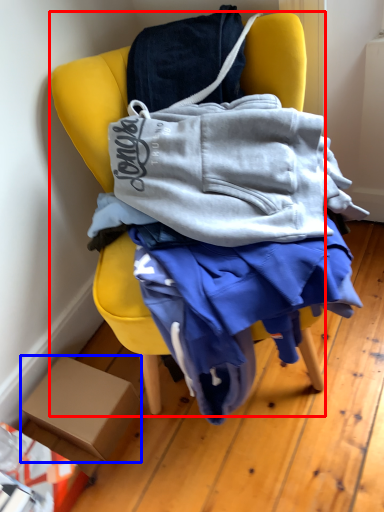
Question: Which point is closer to the camera, chair (highlighted by a red box) or box (highlighted by a blue box)?

Choices:
 (A) chair
 (B) box

Answer: (A)